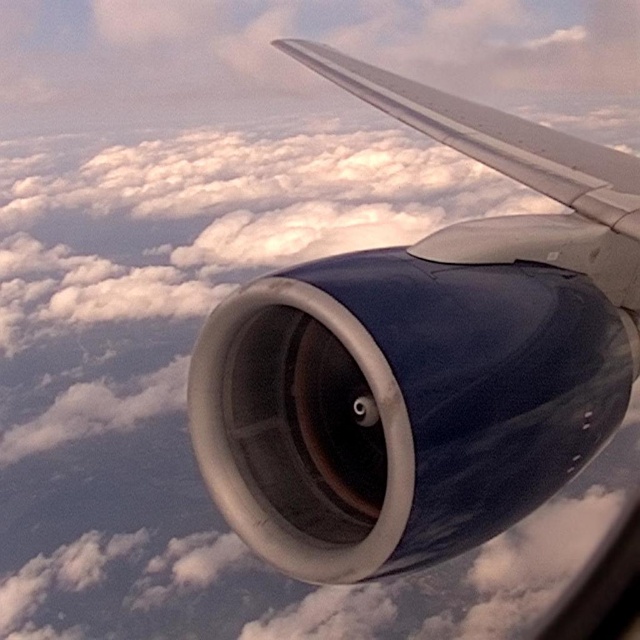
You are a maintenance technician inspecting an airplane from the cockpit. You notice the matte blue engine at center and the metallic silver wing at upper right. Which object would you need to physically reach first if you were moving from the cockpit towards the wing?

You would need to reach the matte blue engine at center first because it is closer to the viewer than the metallic silver wing at upper right, so it lies along the path towards the wing.

You are a flight attendant on an airplane. You notice the matte blue engine at center and the metallic silver wing at upper right through the window. Which object is located below the other?

The matte blue engine at center is positioned under the metallic silver wing at upper right, so the engine is below the wing.